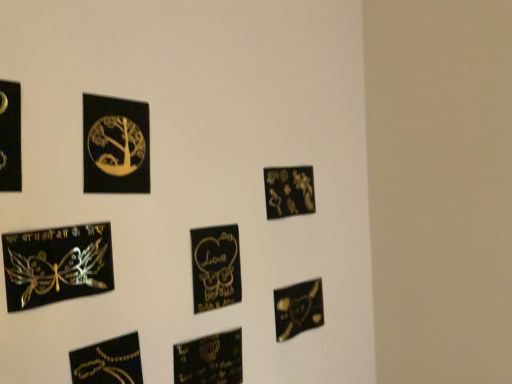
Question: Can you confirm if black glossy picture frame at left, which is the eighth picture frame in right-to-left order, is positioned to the right of matte black heart at lower center, placed as the 4th picture frame when sorted from right to left?

Choices:
 (A) yes
 (B) no

Answer: (B)

Question: Can you confirm if black glossy picture frame at left, which is the eighth picture frame in right-to-left order, is wider than matte black heart at lower center, acting as the fifth picture frame starting from the left?

Choices:
 (A) yes
 (B) no

Answer: (B)

Question: Could you tell me if black glossy picture frame at left, which is the eighth picture frame in right-to-left order, is facing matte black heart at lower center, placed as the 4th picture frame when sorted from right to left?

Choices:
 (A) yes
 (B) no

Answer: (B)

Question: Is black glossy picture frame at left, the 1th picture frame viewed from the left, taller than matte black heart at lower center, placed as the 4th picture frame when sorted from right to left?

Choices:
 (A) no
 (B) yes

Answer: (B)

Question: From the image's perspective, is black glossy picture frame at left, the 1th picture frame viewed from the left, under matte black heart at lower center, placed as the 4th picture frame when sorted from right to left?

Choices:
 (A) no
 (B) yes

Answer: (A)

Question: Would you consider black glossy picture frame at left, which is the eighth picture frame in right-to-left order, to be distant from matte black heart at lower center, acting as the fifth picture frame starting from the left?

Choices:
 (A) no
 (B) yes

Answer: (A)

Question: From the image's perspective, is matte black heart at lower center, acting as the fifth picture frame starting from the left, located beneath matte black heart at lower right, placed as the 1th picture frame when sorted from right to left?

Choices:
 (A) no
 (B) yes

Answer: (B)

Question: Considering the relative positions of matte black heart at lower center, placed as the 4th picture frame when sorted from right to left, and matte black heart at lower right, placed as the 1th picture frame when sorted from right to left, in the image provided, is matte black heart at lower center, placed as the 4th picture frame when sorted from right to left, to the left of matte black heart at lower right, placed as the 1th picture frame when sorted from right to left, from the viewer's perspective?

Choices:
 (A) yes
 (B) no

Answer: (A)

Question: Considering the relative sizes of matte black heart at lower center, acting as the fifth picture frame starting from the left, and matte black heart at lower right, marked as the eighth picture frame in a left-to-right arrangement, in the image provided, is matte black heart at lower center, acting as the fifth picture frame starting from the left, bigger than matte black heart at lower right, marked as the eighth picture frame in a left-to-right arrangement,?

Choices:
 (A) no
 (B) yes

Answer: (A)

Question: Is matte black heart at lower center, acting as the fifth picture frame starting from the left, taller than matte black heart at lower right, marked as the eighth picture frame in a left-to-right arrangement?

Choices:
 (A) no
 (B) yes

Answer: (A)

Question: Is matte black heart at lower center, acting as the fifth picture frame starting from the left, looking in the opposite direction of matte black heart at lower right, placed as the 1th picture frame when sorted from right to left?

Choices:
 (A) yes
 (B) no

Answer: (B)

Question: Is matte black heart at lower center, acting as the fifth picture frame starting from the left, thinner than matte black heart at lower right, placed as the 1th picture frame when sorted from right to left?

Choices:
 (A) yes
 (B) no

Answer: (B)

Question: Considering the relative positions of black glossy picture frame at left, which is the eighth picture frame in right-to-left order, and matte gold plaque at upper right, which ranks as the 2th picture frame in right-to-left order, in the image provided, is black glossy picture frame at left, which is the eighth picture frame in right-to-left order, to the left of matte gold plaque at upper right, which ranks as the 2th picture frame in right-to-left order, from the viewer's perspective?

Choices:
 (A) no
 (B) yes

Answer: (B)